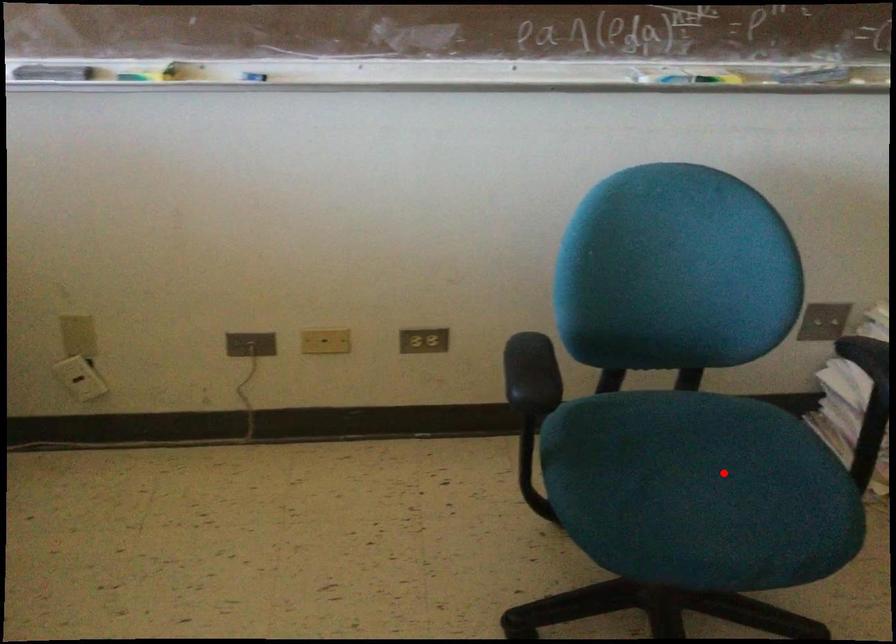
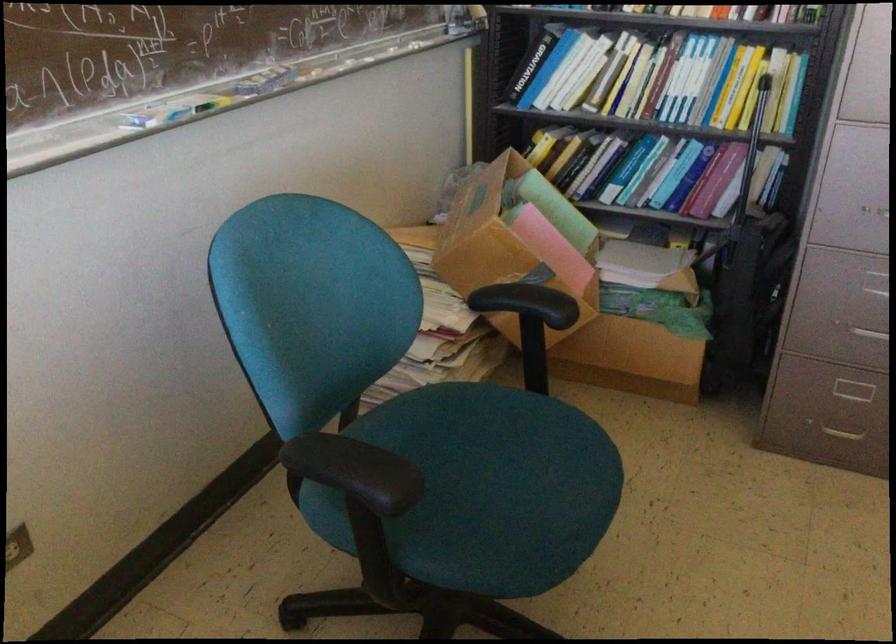
The point at the highlighted location is marked in the first image. Where is the corresponding point in the second image?

(498, 458)